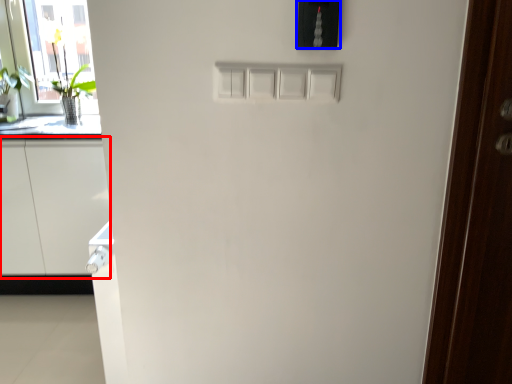
Question: Among these objects, which one is nearest to the camera, cabinetry (highlighted by a red box) or light switch (highlighted by a blue box)?

Choices:
 (A) cabinetry
 (B) light switch

Answer: (B)